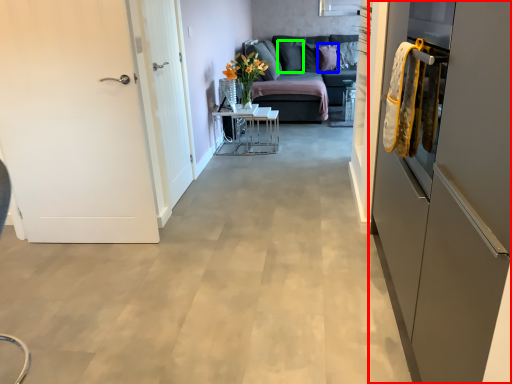
Question: Considering the real-world distances, which object is closest to cabinetry (highlighted by a red box)? pillow (highlighted by a blue box) or pillow (highlighted by a green box).

Choices:
 (A) pillow
 (B) pillow

Answer: (A)